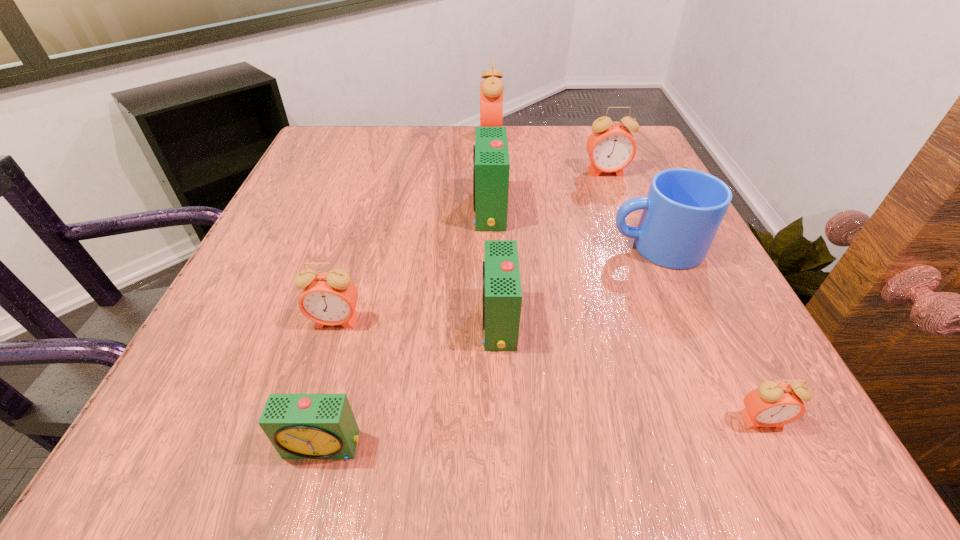
The height and width of the screenshot is (540, 960). Identify the location of free space between the third nearest pink alarm clock and the second smallest green alarm clock. (552, 247).

This screenshot has height=540, width=960. I want to click on blank region between the leftmost pink alarm clock and the farthest pink alarm clock, so click(414, 228).

This screenshot has width=960, height=540. I want to click on vacant area between the second nearest alarm clock and the farthest pink alarm clock, so click(626, 278).

Point out which object is positioned as the fourth nearest to the nearest pink alarm clock. Please provide its 2D coordinates. Your answer should be formatted as a tuple, i.e. [(x, y)], where the tuple contains the x and y coordinates of a point satisfying the conditions above.

[(300, 426)]

You are a GUI agent. You are given a task and a screenshot of the screen. Output one action in this format:
    pyautogui.click(x=<x>, y=<y>)
    Task: Click on the object that stands as the sixth closest to the farthest object
    Image resolution: width=960 pixels, height=540 pixels.
    Given the screenshot: What is the action you would take?
    pyautogui.click(x=300, y=426)

Select which alarm clock appears as the sixth closest to the smallest pink alarm clock. Please provide its 2D coordinates. Your answer should be formatted as a tuple, i.e. [(x, y)], where the tuple contains the x and y coordinates of a point satisfying the conditions above.

[(491, 89)]

Select which alarm clock is the second closest to the second farthest alarm clock. Please provide its 2D coordinates. Your answer should be formatted as a tuple, i.e. [(x, y)], where the tuple contains the x and y coordinates of a point satisfying the conditions above.

[(491, 89)]

This screenshot has width=960, height=540. Find the location of `the third closest pink alarm clock relative to the farthest alarm clock`. the third closest pink alarm clock relative to the farthest alarm clock is located at coordinates (772, 404).

Locate which pink alarm clock ranks in proximity to the second farthest green alarm clock. Please provide its 2D coordinates. Your answer should be formatted as a tuple, i.e. [(x, y)], where the tuple contains the x and y coordinates of a point satisfying the conditions above.

[(330, 298)]

Choose which green alarm clock is the second nearest neighbor to the seventh nearest object. Please provide its 2D coordinates. Your answer should be formatted as a tuple, i.e. [(x, y)], where the tuple contains the x and y coordinates of a point satisfying the conditions above.

[(501, 292)]